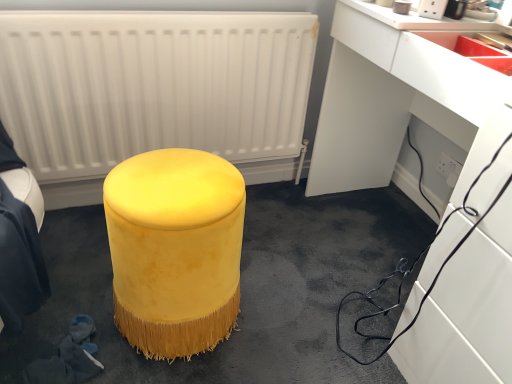
Question: Does white glossy computer desk at lower right turn towards white plastic electric outlet at lower right?

Choices:
 (A) no
 (B) yes

Answer: (A)

Question: Considering the relative sizes of white glossy computer desk at lower right and white plastic electric outlet at lower right in the image provided, is white glossy computer desk at lower right smaller than white plastic electric outlet at lower right?

Choices:
 (A) no
 (B) yes

Answer: (A)

Question: From a real-world perspective, does white glossy computer desk at lower right sit lower than white plastic electric outlet at lower right?

Choices:
 (A) no
 (B) yes

Answer: (A)

Question: Does white glossy computer desk at lower right have a lesser height compared to white plastic electric outlet at lower right?

Choices:
 (A) no
 (B) yes

Answer: (A)

Question: Are white glossy computer desk at lower right and white plastic electric outlet at lower right beside each other?

Choices:
 (A) yes
 (B) no

Answer: (B)

Question: Is white plastic electric outlet at lower right completely or partially inside white glossy computer desk at lower right?

Choices:
 (A) yes
 (B) no

Answer: (A)

Question: Is matte red sink at upper right beside velvet yellow ottoman at center?

Choices:
 (A) yes
 (B) no

Answer: (B)

Question: Is matte red sink at upper right smaller than velvet yellow ottoman at center?

Choices:
 (A) yes
 (B) no

Answer: (A)

Question: From the image's perspective, is matte red sink at upper right on top of velvet yellow ottoman at center?

Choices:
 (A) yes
 (B) no

Answer: (A)

Question: Is matte red sink at upper right taller than velvet yellow ottoman at center?

Choices:
 (A) no
 (B) yes

Answer: (A)

Question: Considering the relative positions of matte red sink at upper right and velvet yellow ottoman at center in the image provided, is matte red sink at upper right in front of velvet yellow ottoman at center?

Choices:
 (A) yes
 (B) no

Answer: (B)

Question: Can you confirm if matte red sink at upper right is bigger than velvet yellow ottoman at center?

Choices:
 (A) yes
 (B) no

Answer: (B)

Question: Can you confirm if velvet yellow ottoman at center is wider than matte red sink at upper right?

Choices:
 (A) yes
 (B) no

Answer: (B)